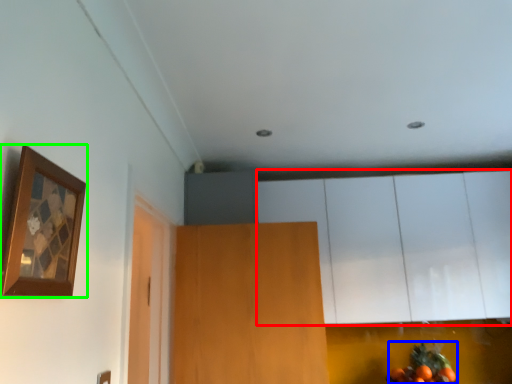
Question: Which is nearer to the cabinetry (highlighted by a red box)? fruit (highlighted by a blue box) or picture frame (highlighted by a green box).

Choices:
 (A) fruit
 (B) picture frame

Answer: (A)